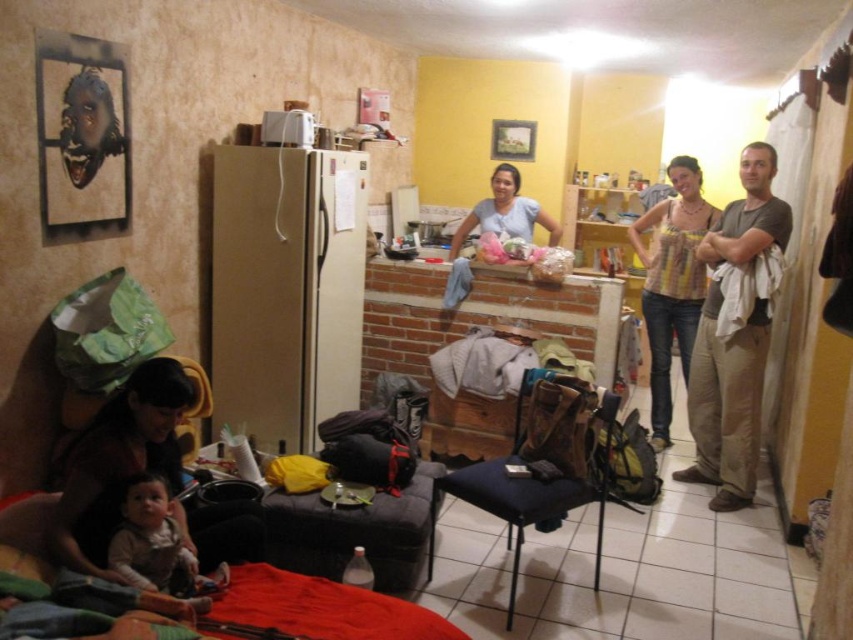
Question: Which object is farther from the camera taking this photo?

Choices:
 (A) light brown fabric baby at lower left
 (B) brown cotton shirt at right
 (C) dark gray fabric stool at center

Answer: (B)

Question: Is brown cotton shirt at right above dark gray fabric stool at center?

Choices:
 (A) yes
 (B) no

Answer: (A)

Question: Can you confirm if brown cotton shirt at right is positioned above dark gray fabric stool at center?

Choices:
 (A) no
 (B) yes

Answer: (B)

Question: Which is farther from the dark gray fabric stool at center?

Choices:
 (A) brown cotton shirt at right
 (B) light brown fabric baby at lower left

Answer: (A)

Question: Can you confirm if brown cotton shirt at right is positioned below light brown fabric baby at lower left?

Choices:
 (A) no
 (B) yes

Answer: (A)

Question: Among these points, which one is nearest to the camera?

Choices:
 (A) (727, 422)
 (B) (132, 496)
 (C) (305, 493)

Answer: (B)